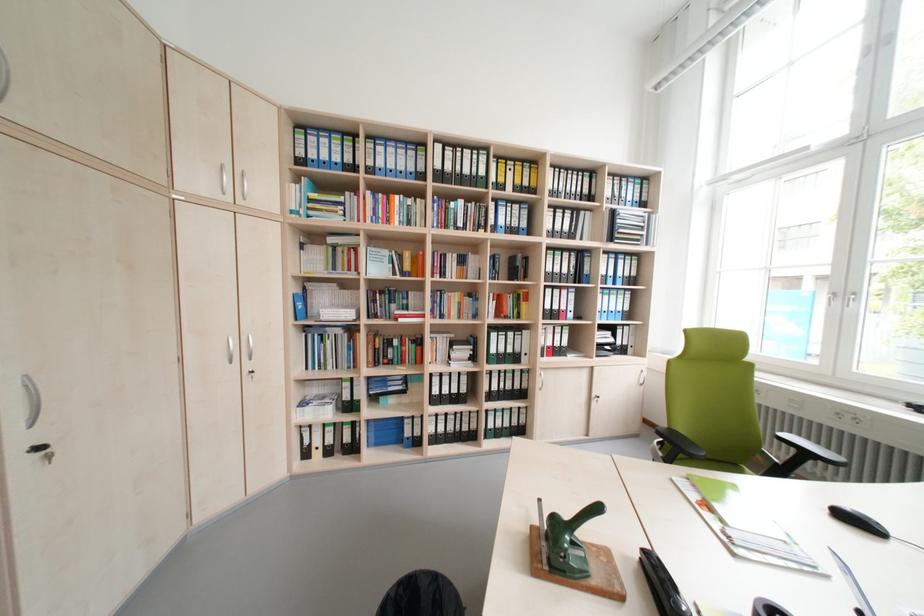
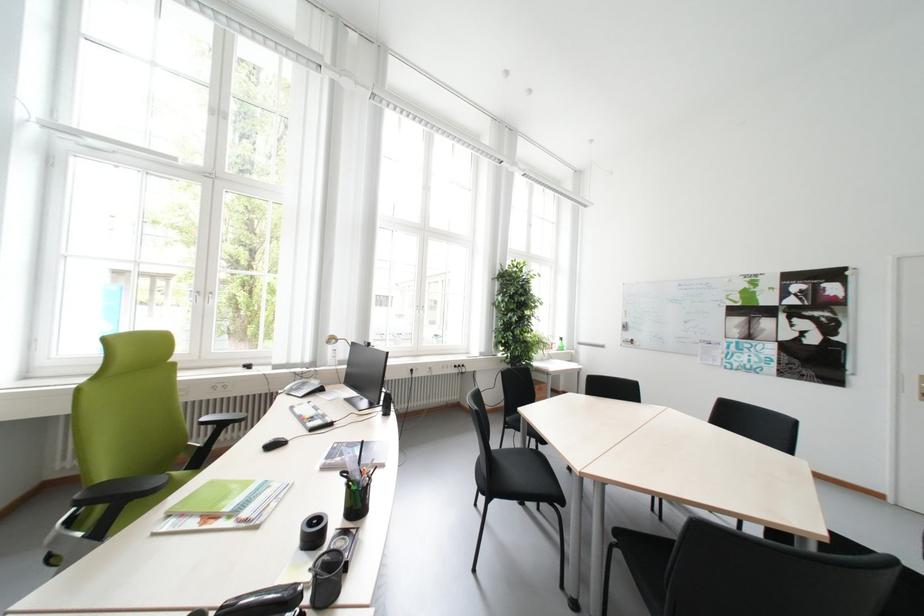
Question: The camera is either moving clockwise (left) or counter-clockwise (right) around the object. The first image is from the beginning of the video and the second image is from the end. Is the camera moving left or right when shooting the video?

Choices:
 (A) Left
 (B) Right

Answer: (A)